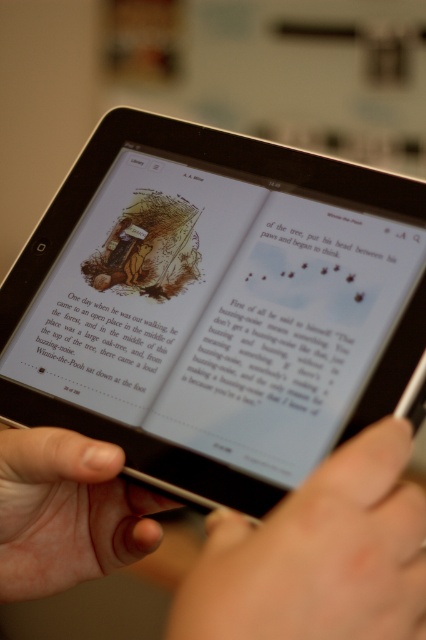
You are looking at the tablet screen and notice two points marked on it. The first point is at coordinates point [186,413] and the second is at point [91,572]. Which point appears closer to you on the screen?

Point [186,413] is closer to the camera than point [91,572], so it appears closer to you on the screen.

You are a delivery drone carrying a package that needs to be placed on the white paper at center. You are currently hovering above the black glossy tablet at center. Can you safely land the drone to deliver the package without hitting the tablet?

The distance between the black glossy tablet at center and the white paper at center is 2.91 inches. Since the drone needs to land safely, this distance might be too close for a safe landing, so it is not advisable to attempt landing between them.